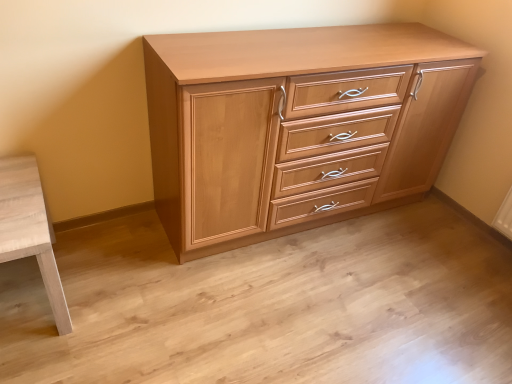
Identify the location of free space that is in between light wood table at lower left and light wood chest of drawers at center. (143, 264).